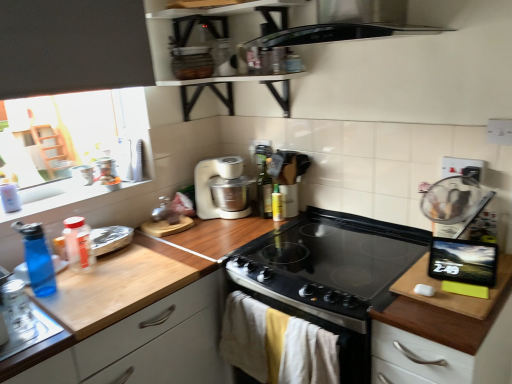
Question: Considering the relative positions of blue translucent bottle at left, placed as the first bottle when sorted from front to back, and translucent plastic bottle at left, the third bottle when ordered from right to left, in the image provided, is blue translucent bottle at left, placed as the first bottle when sorted from front to back, to the left or to the right of translucent plastic bottle at left, the third bottle when ordered from right to left,?

Choices:
 (A) left
 (B) right

Answer: (A)

Question: In terms of width, does blue translucent bottle at left, acting as the fourth bottle starting from the right, look wider or thinner when compared to translucent plastic bottle at left, which appears as the 2th bottle when viewed from the left?

Choices:
 (A) thin
 (B) wide

Answer: (B)

Question: Estimate the real-world distances between objects in this image. Which object is closer to the translucent plastic bottle at left, which appears as the 2th bottle when viewed from the left?

Choices:
 (A) matte black shelf at upper center
 (B) black glass gas stove at center
 (C) blue translucent bottle at left, placed as the 1th bottle when sorted from left to right
 (D) green glass bottle at center, marked as the third bottle in a left-to-right arrangement
 (E) wooden cutting board at right

Answer: (C)

Question: Based on their relative distances, which object is farther from the clear glass jar at left?

Choices:
 (A) translucent plastic bottle at left, arranged as the second bottle when viewed from the front
 (B) blue translucent bottle at left, acting as the fourth bottle starting from the right
 (C) yellow matte bottle at center, acting as the 3th bottle starting from the front
 (D) black glass gas stove at center
 (E) white matte food processor at center

Answer: (C)